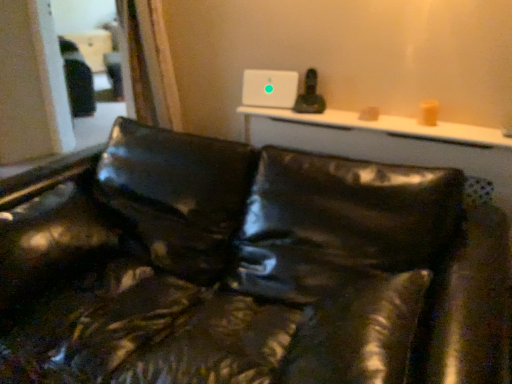
Question: Is white glossy table at upper center to the left or to the right of matte black couch at center in the image?

Choices:
 (A) right
 (B) left

Answer: (A)

Question: In the image, is white glossy table at upper center positioned in front of or behind matte black couch at center?

Choices:
 (A) front
 (B) behind

Answer: (B)

Question: From a real-world perspective, relative to matte black couch at center, is white glossy table at upper center vertically above or below?

Choices:
 (A) below
 (B) above

Answer: (B)

Question: Considering their positions, is matte black couch at center located in front of or behind white glossy table at upper center?

Choices:
 (A) front
 (B) behind

Answer: (A)

Question: From the image's perspective, is matte black couch at center positioned above or below white glossy table at upper center?

Choices:
 (A) above
 (B) below

Answer: (B)

Question: From their relative heights in the image, would you say matte black couch at center is taller or shorter than white glossy table at upper center?

Choices:
 (A) tall
 (B) short

Answer: (A)

Question: In terms of width, does matte black couch at center look wider or thinner when compared to white glossy table at upper center?

Choices:
 (A) wide
 (B) thin

Answer: (A)